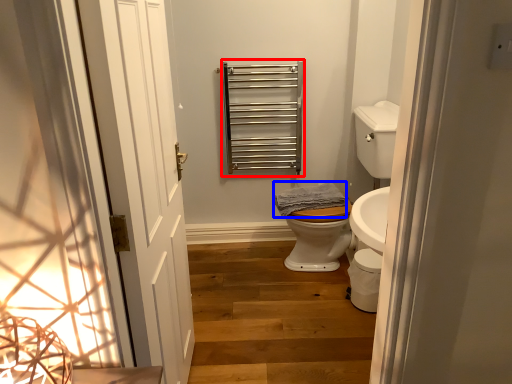
Question: Which of the following is the farthest to the observer, balustrade (highlighted by a red box) or material (highlighted by a blue box)?

Choices:
 (A) balustrade
 (B) material

Answer: (A)